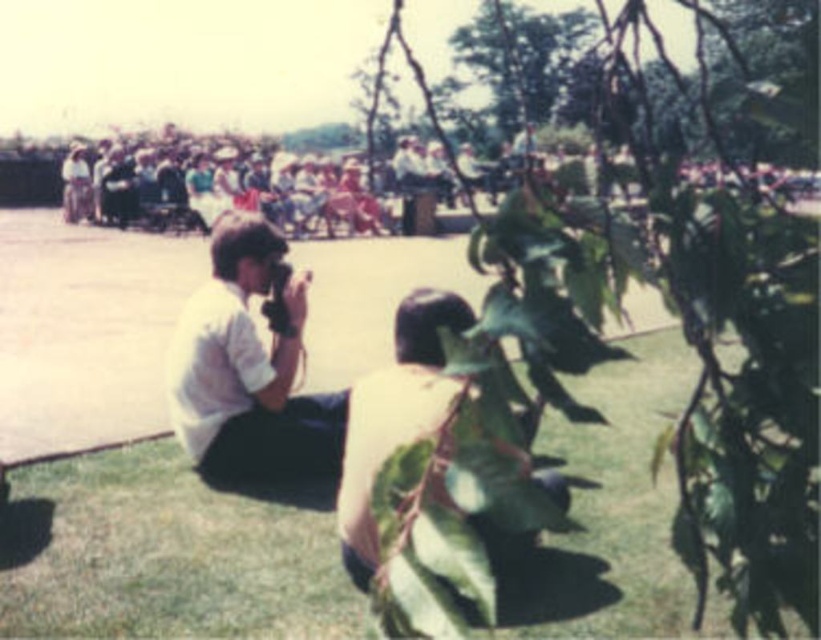
You are an event planner trying to set up a new booth for the outdoor event. The booth requires a specific placement where it won not block the view of the green leafy tree at center. Given the tree is located at coordinates point 0.561, 0.756, where should you place the booth to ensure it doesn not obstruct the tree?

The green leafy tree at center is located at coordinates point (620, 358). To avoid blocking the tree, the booth should be placed away from this coordinate, ensuring it does not overlap or cover the area where the tree is situated.

You are a photographer trying to capture a clear shot of the crowd in the background. You have two options for your vantage point. One is to kneel on the green grass at lower center, and the other is to stand under the green leafy tree at center. Which vantage point would give you a better view of the crowd?

The green leafy tree at center is larger than the green grass at lower center, so standing under the green leafy tree at center would provide a better view of the crowd since it offers more coverage and elevation compared to the lower grass area.

You are a photographer trying to capture a wide shot of the crowd behind you. You have the white matte camera at center and notice the green leafy tree at center in your frame. Since the tree is blocking part of the crowd, can you adjust your position to fit both the tree and the crowd in the photo without moving the camera?

The green leafy tree at center is wider than the white matte camera at center, so adjusting your position might not be possible since the tree is wider and could still block the crowd. Consider moving the camera slightly to the side or zooming out to include both.